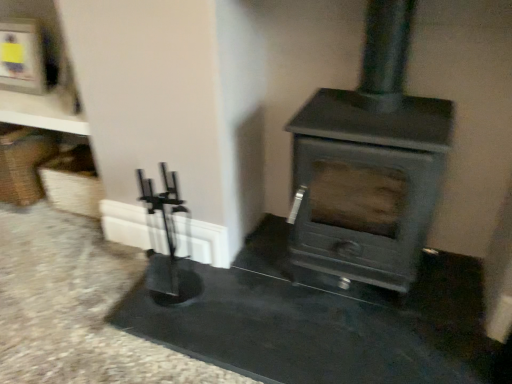
Where is `free spot above matte gray wood burning stove at right (from a real-world perspective)`? free spot above matte gray wood burning stove at right (from a real-world perspective) is located at coordinates (380, 117).